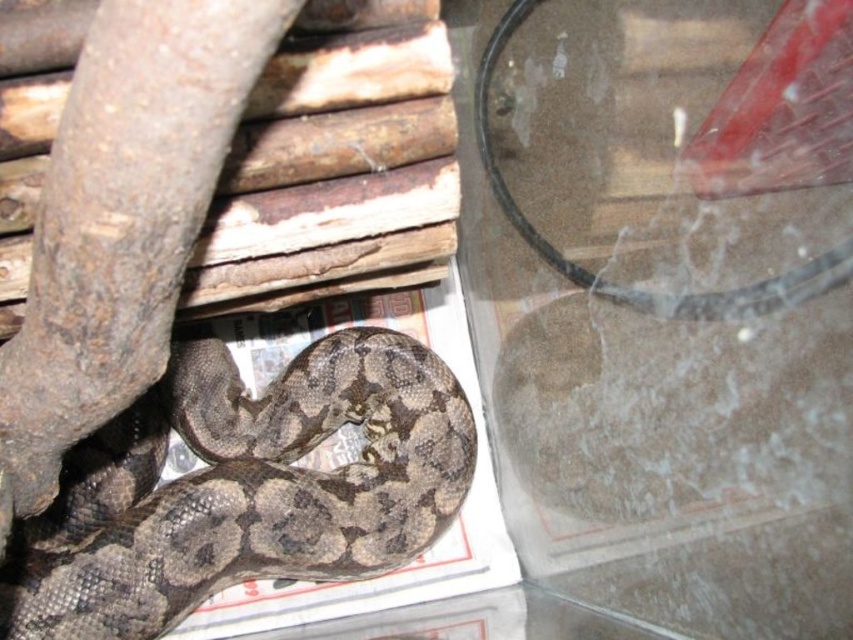
You are a pet owner looking at the terrarium. You see the transparent plastic glass at center and the brown textured snake at lower left. Which object is positioned to the right of the other?

The transparent plastic glass at center is to the right of the brown textured snake at lower left.

You are a small toy mouse that is 3 inches long. You are placed on the transparent plastic glass at center and want to reach the brown textured snake at lower left. Can you crawl from the glass to the snake without falling off?

The transparent plastic glass at center is 18.75 inches away from the brown textured snake at lower left. Since the mouse is only 3 inches long, it would need to crawl 18.75 inches to reach the snake. However, the question states the mouse is placed on the glass and wants to reach the snake. The distance is too far for the mouse to crawl in one go, but the question doesn not mention any obstacles or the mouse s ability to move that distance. The answer should focus on the distance provided. Since the glass.